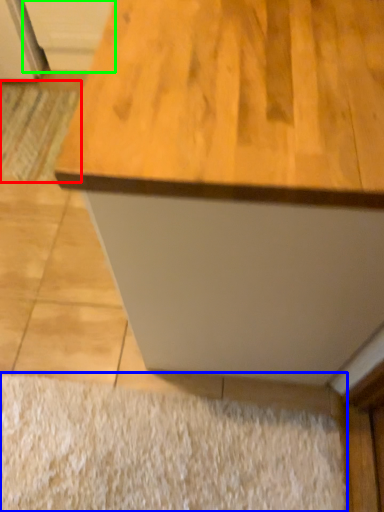
Question: Which object is positioned closest to doormat (highlighted by a red box)? Select from doormat (highlighted by a blue box) and cabinetry (highlighted by a green box).

Choices:
 (A) doormat
 (B) cabinetry

Answer: (B)